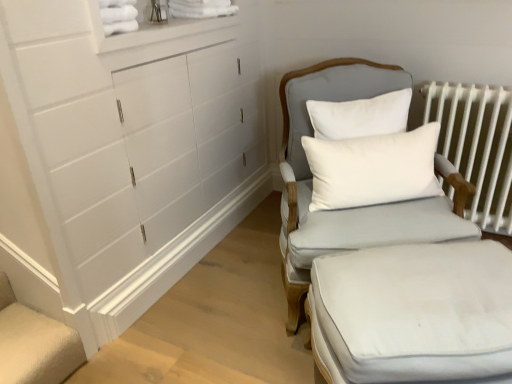
Question: Does light gray fabric chair at center-right have a greater height compared to white metal radiator at right?

Choices:
 (A) no
 (B) yes

Answer: (B)

Question: Could you tell me if light gray fabric chair at center-right is turned towards white metal radiator at right?

Choices:
 (A) yes
 (B) no

Answer: (B)

Question: Considering the relative sizes of light gray fabric chair at center-right and white metal radiator at right in the image provided, is light gray fabric chair at center-right smaller than white metal radiator at right?

Choices:
 (A) yes
 (B) no

Answer: (B)

Question: From the image's perspective, would you say light gray fabric chair at center-right is positioned over white metal radiator at right?

Choices:
 (A) yes
 (B) no

Answer: (B)

Question: Is light gray fabric chair at center-right shorter than white metal radiator at right?

Choices:
 (A) no
 (B) yes

Answer: (A)

Question: Is white fabric ottoman at lower right bigger or smaller than white metal radiator at right?

Choices:
 (A) small
 (B) big

Answer: (B)

Question: From a real-world perspective, is white fabric ottoman at lower right positioned above or below white metal radiator at right?

Choices:
 (A) below
 (B) above

Answer: (A)

Question: Considering the positions of white fabric ottoman at lower right and white metal radiator at right in the image, is white fabric ottoman at lower right wider or thinner than white metal radiator at right?

Choices:
 (A) wide
 (B) thin

Answer: (A)

Question: From the image's perspective, is white fabric ottoman at lower right above or below white metal radiator at right?

Choices:
 (A) above
 (B) below

Answer: (B)

Question: From the image's perspective, relative to white cotton pillow at center, is light gray fabric chair at center-right above or below?

Choices:
 (A) below
 (B) above

Answer: (A)

Question: Does point (302, 170) appear closer or farther from the camera than point (307, 157)?

Choices:
 (A) closer
 (B) farther

Answer: (B)

Question: Is light gray fabric chair at center-right bigger or smaller than white cotton pillow at center?

Choices:
 (A) small
 (B) big

Answer: (B)

Question: Would you say light gray fabric chair at center-right is inside or outside white cotton pillow at center?

Choices:
 (A) outside
 (B) inside

Answer: (A)

Question: In terms of size, does white fabric ottoman at lower right appear bigger or smaller than light gray fabric chair at center-right?

Choices:
 (A) small
 (B) big

Answer: (A)

Question: From the image's perspective, relative to light gray fabric chair at center-right, is white fabric ottoman at lower right above or below?

Choices:
 (A) above
 (B) below

Answer: (B)